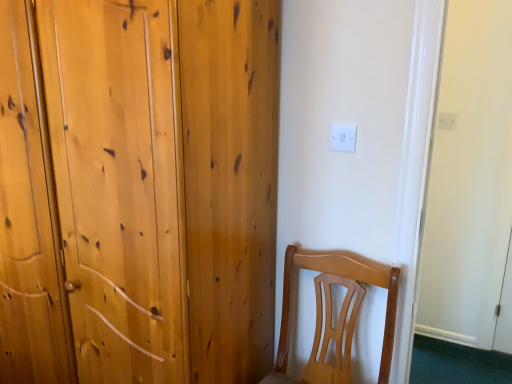
Question: From a real-world perspective, is natural wood wardrobe at left positioned under light brown wood chair at lower right based on gravity?

Choices:
 (A) no
 (B) yes

Answer: (A)

Question: Is natural wood wardrobe at left to the left of light brown wood chair at lower right from the viewer's perspective?

Choices:
 (A) yes
 (B) no

Answer: (A)

Question: Is natural wood wardrobe at left turned away from light brown wood chair at lower right?

Choices:
 (A) no
 (B) yes

Answer: (A)

Question: Is the surface of natural wood wardrobe at left in direct contact with light brown wood chair at lower right?

Choices:
 (A) no
 (B) yes

Answer: (A)

Question: Could you tell me if natural wood wardrobe at left is turned towards light brown wood chair at lower right?

Choices:
 (A) yes
 (B) no

Answer: (B)

Question: Can you confirm if natural wood wardrobe at left is positioned to the right of light brown wood chair at lower right?

Choices:
 (A) no
 (B) yes

Answer: (A)

Question: From a real-world perspective, is natural wood wardrobe at left over white plastic electric outlet at upper center, the 1th electric outlet when ordered from bottom to top?

Choices:
 (A) no
 (B) yes

Answer: (A)

Question: Does natural wood wardrobe at left have a lesser width compared to white plastic electric outlet at upper center, which is the second electric outlet in top-to-bottom order?

Choices:
 (A) yes
 (B) no

Answer: (B)

Question: Is natural wood wardrobe at left facing towards white plastic electric outlet at upper center, which is the second electric outlet in top-to-bottom order?

Choices:
 (A) no
 (B) yes

Answer: (A)

Question: Considering the relative sizes of natural wood wardrobe at left and white plastic electric outlet at upper center, the second electric outlet in the right-to-left sequence, in the image provided, is natural wood wardrobe at left taller than white plastic electric outlet at upper center, the second electric outlet in the right-to-left sequence,?

Choices:
 (A) yes
 (B) no

Answer: (A)

Question: Is natural wood wardrobe at left with white plastic electric outlet at upper center, the second electric outlet in the right-to-left sequence?

Choices:
 (A) no
 (B) yes

Answer: (A)

Question: From the image's perspective, is natural wood wardrobe at left on top of white plastic electric outlet at upper center, which is the second electric outlet in top-to-bottom order?

Choices:
 (A) yes
 (B) no

Answer: (B)

Question: Is the depth of natural wood wardrobe at left less than that of white plastic electric outlet at upper right, positioned as the 1th electric outlet in right-to-left order?

Choices:
 (A) no
 (B) yes

Answer: (B)